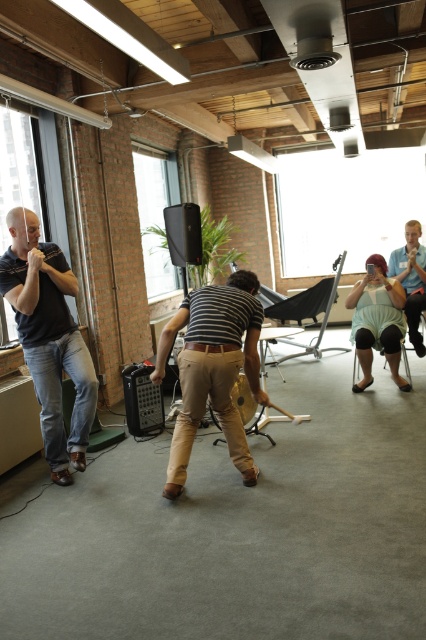
Question: Which point appears closest to the camera in this image?

Choices:
 (A) (204, 346)
 (B) (363, 284)
 (C) (244, 390)

Answer: (A)

Question: Considering the relative positions of matte black shirt at left and brown leather belt at center in the image provided, where is matte black shirt at left located with respect to brown leather belt at center?

Choices:
 (A) left
 (B) right

Answer: (A)

Question: Which point is closer to the camera?

Choices:
 (A) (233, 346)
 (B) (236, 381)

Answer: (A)

Question: Is light blue denim jeans at lower right bigger than wooden acoustic guitar at center?

Choices:
 (A) yes
 (B) no

Answer: (A)

Question: Is matte black shirt at left further to the viewer compared to light blue denim jeans at lower right?

Choices:
 (A) yes
 (B) no

Answer: (B)

Question: Which object is the farthest from the brown leather belt at center?

Choices:
 (A) matte blue shirt at center
 (B) light blue denim jeans at lower right

Answer: (B)